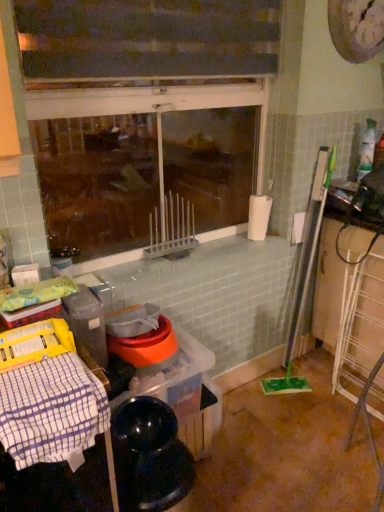
This screenshot has height=512, width=384. Identify the location of white checkered cloth at lower left. (52, 411).

Measure the distance between point (x=87, y=371) and camera.

The distance of point (x=87, y=371) from camera is 39.09 inches.

What do you see at coordinates (52, 411) in the screenshot? The image size is (384, 512). I see `white checkered cloth at lower left` at bounding box center [52, 411].

Describe the element at coordinates (150, 103) in the screenshot. I see `transparent glass window at center` at that location.

Find the location of a particular element. transparent glass window at center is located at coordinates (150, 103).

Identify the location of white checkered cloth at lower left. This screenshot has width=384, height=512. (52, 411).

Can you confirm if white checkered cloth at lower left is positioned to the left of transparent glass window at center?

Yes.

Which is behind, white checkered cloth at lower left or transparent glass window at center?

transparent glass window at center is further away from the camera.

Which is closer to the camera, (x=74, y=423) or (x=115, y=91)?

Positioned in front is point (x=74, y=423).

From the image's perspective, does white checkered cloth at lower left appear lower than transparent glass window at center?

Yes, from the image's perspective, white checkered cloth at lower left is below transparent glass window at center.

From a real-world perspective, does white checkered cloth at lower left stand above transparent glass window at center?

No, from a real-world perspective, white checkered cloth at lower left is not above transparent glass window at center.

Considering the relative sizes of white checkered cloth at lower left and transparent glass window at center in the image provided, is white checkered cloth at lower left thinner than transparent glass window at center?

Incorrect, the width of white checkered cloth at lower left is not less than that of transparent glass window at center.

Between white checkered cloth at lower left and transparent glass window at center, which one has less height?

white checkered cloth at lower left is shorter.

Between white checkered cloth at lower left and transparent glass window at center, which one has smaller size?

Smaller between the two is white checkered cloth at lower left.

Would you say white checkered cloth at lower left is inside or outside transparent glass window at center?

white checkered cloth at lower left is located beyond the bounds of transparent glass window at center.

Is white checkered cloth at lower left next to transparent glass window at center and touching it?

white checkered cloth at lower left and transparent glass window at center are not in contact.

Is white checkered cloth at lower left looking in the opposite direction of transparent glass window at center?

No, white checkered cloth at lower left is not facing away from transparent glass window at center.

The height and width of the screenshot is (512, 384). I want to click on window on the right of white checkered cloth at lower left, so click(150, 103).

In the scene shown: Is transparent glass window at center at the right side of white checkered cloth at lower left?

Indeed, transparent glass window at center is positioned on the right side of white checkered cloth at lower left.

From the picture: Which object is further away from the camera, transparent glass window at center or white checkered cloth at lower left?

transparent glass window at center is behind.

Considering the positions of point (161, 113) and point (44, 437), is point (161, 113) closer or farther from the camera than point (44, 437)?

Clearly, point (161, 113) is more distant from the camera than point (44, 437).

From the image's perspective, which is above, transparent glass window at center or white checkered cloth at lower left?

transparent glass window at center, from the image's perspective.

From a real-world perspective, who is located higher, transparent glass window at center or white checkered cloth at lower left?

transparent glass window at center is physically above.

Considering the sizes of transparent glass window at center and white checkered cloth at lower left in the image, is transparent glass window at center wider or thinner than white checkered cloth at lower left?

Considering their sizes, transparent glass window at center looks slimmer than white checkered cloth at lower left.

Considering the sizes of objects transparent glass window at center and white checkered cloth at lower left in the image provided, who is shorter, transparent glass window at center or white checkered cloth at lower left?

white checkered cloth at lower left.

Consider the image. Which of these two, transparent glass window at center or white checkered cloth at lower left, is bigger?

transparent glass window at center is bigger.

Would you say white checkered cloth at lower left is part of transparent glass window at center's contents?

No, white checkered cloth at lower left is not inside transparent glass window at center.

Would you say transparent glass window at center is a long distance from white checkered cloth at lower left?

No, transparent glass window at center is not far away from white checkered cloth at lower left.

In the scene shown: Could you tell me if transparent glass window at center is facing white checkered cloth at lower left?

Yes, transparent glass window at center is turned towards white checkered cloth at lower left.

Find the location of a particular element. The width and height of the screenshot is (384, 512). window on the right of white checkered cloth at lower left is located at coordinates (150, 103).

Image resolution: width=384 pixels, height=512 pixels. I want to click on blanket on the left of transparent glass window at center, so click(x=52, y=411).

You are a GUI agent. You are given a task and a screenshot of the screen. Output one action in this format:
    pyautogui.click(x=<x>, y=<y>)
    Task: Click on the blanket lying in front of the transparent glass window at center
    This screenshot has width=384, height=512.
    Given the screenshot: What is the action you would take?
    pyautogui.click(x=52, y=411)